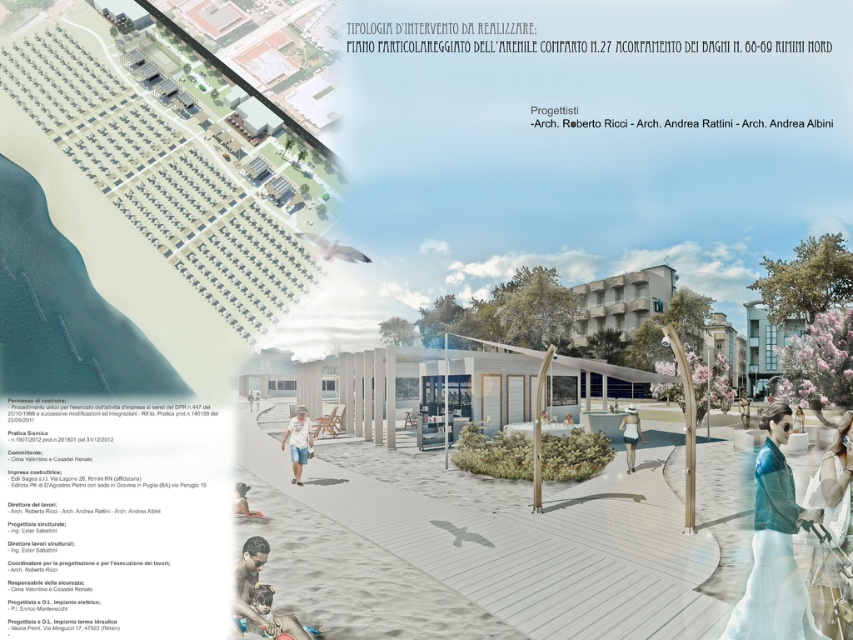
You are a visitor standing on the beach and want to reach the shaded area under the curved metal frames shown in the architectural rendering. The path to the shaded area goes through the matte white sand at lower center and near the white wood person at center. Which object will you encounter first as you walk towards the shaded area?

You will first encounter the white wood person at center before reaching the matte white sand at lower center because the matte white sand at lower center is located below the white wood person at center, meaning the person is closer to your starting position on the beach.

You are a park ranger who wants to place a new bench between the matte white sand at lower center and the white wood person at center. The bench requires a minimum of 6 meters of space to be placed safely. Based on the image, can you determine if there is enough space between them to place the bench?

The distance between the matte white sand at lower center and the white wood person at center is 5.50 meters, which is less than the required 6 meters. Therefore, there is not enough space to place the bench safely.